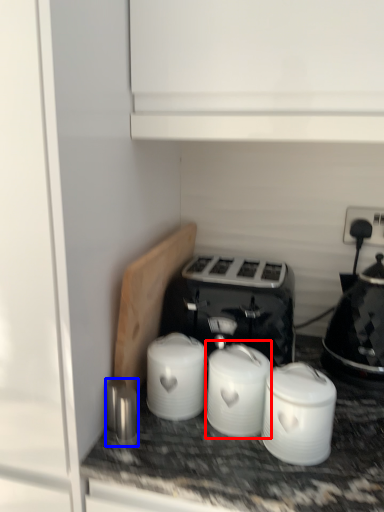
Question: Which object is closer to the camera taking this photo, appliance (highlighted by a red box) or appliance (highlighted by a blue box)?

Choices:
 (A) appliance
 (B) appliance

Answer: (A)